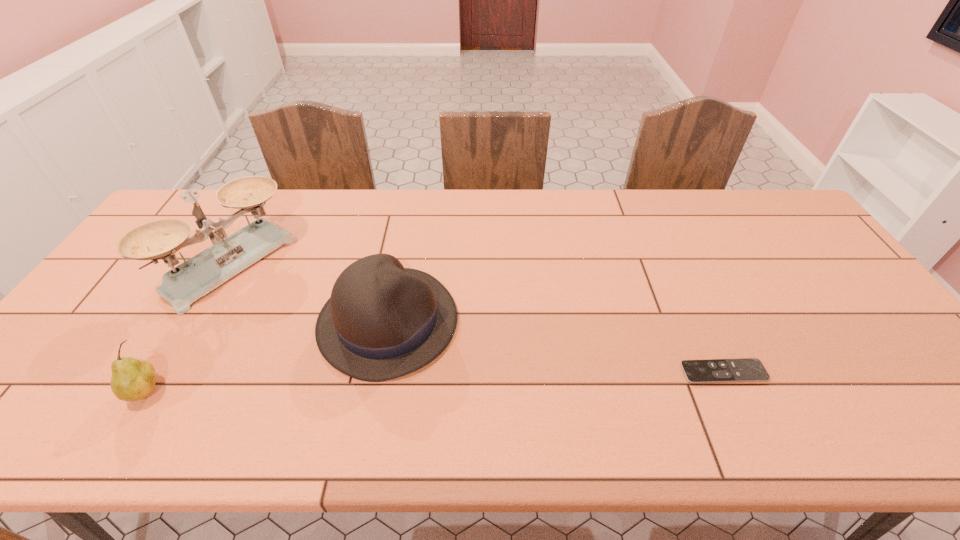
Where is `free space at the far edge of the desktop`? This screenshot has width=960, height=540. free space at the far edge of the desktop is located at coordinates (558, 211).

The width and height of the screenshot is (960, 540). Find the location of `vacant space at the near edge of the desktop`. vacant space at the near edge of the desktop is located at coordinates (223, 382).

I want to click on free space at the left edge of the desktop, so click(122, 275).

The width and height of the screenshot is (960, 540). I want to click on free space at the right edge of the desktop, so click(x=804, y=246).

Find the location of `vacant space at the far right corner of the desktop`. vacant space at the far right corner of the desktop is located at coordinates (739, 195).

This screenshot has height=540, width=960. I want to click on empty space that is in between the remote control and the scale, so click(x=478, y=319).

The height and width of the screenshot is (540, 960). What are the coordinates of `vacant area between the pear and the remote control` in the screenshot? It's located at (436, 381).

Where is `free space between the remote control and the pear`? free space between the remote control and the pear is located at coordinates (436, 381).

Locate an element on the screen. This screenshot has height=540, width=960. vacant point located between the scale and the remote control is located at coordinates (478, 319).

The height and width of the screenshot is (540, 960). What are the coordinates of `vacant region between the third object from left to right and the remote control` in the screenshot? It's located at (556, 347).